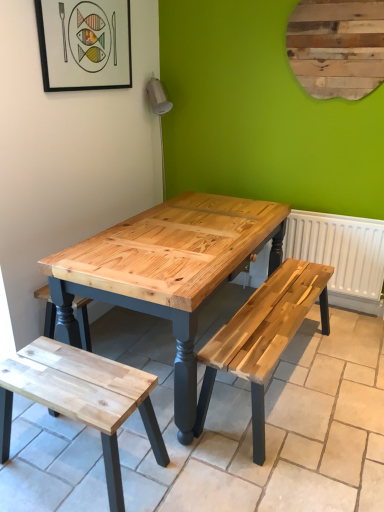
Where is `free region under natural wood bench at lower left (from a real-world perspective)`? free region under natural wood bench at lower left (from a real-world perspective) is located at coordinates (92, 463).